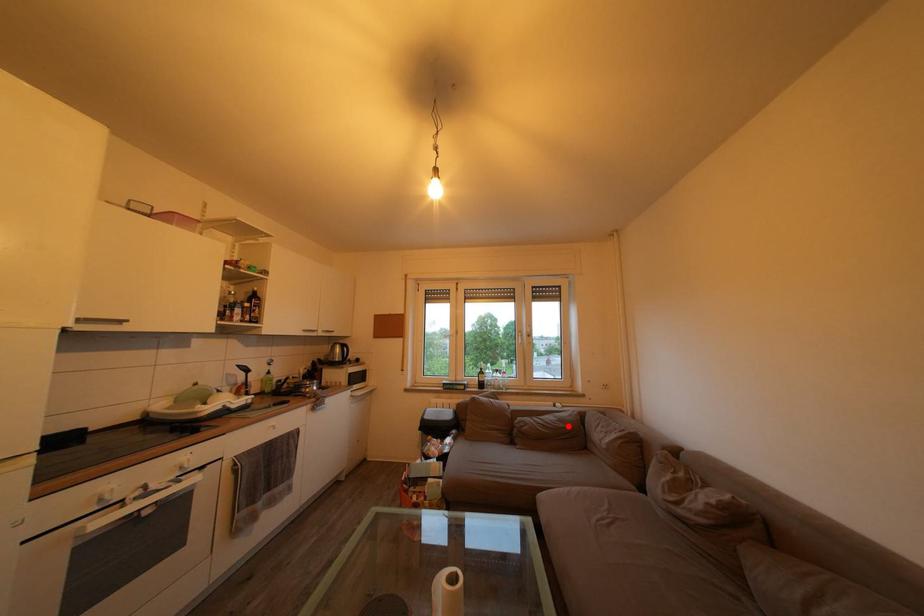
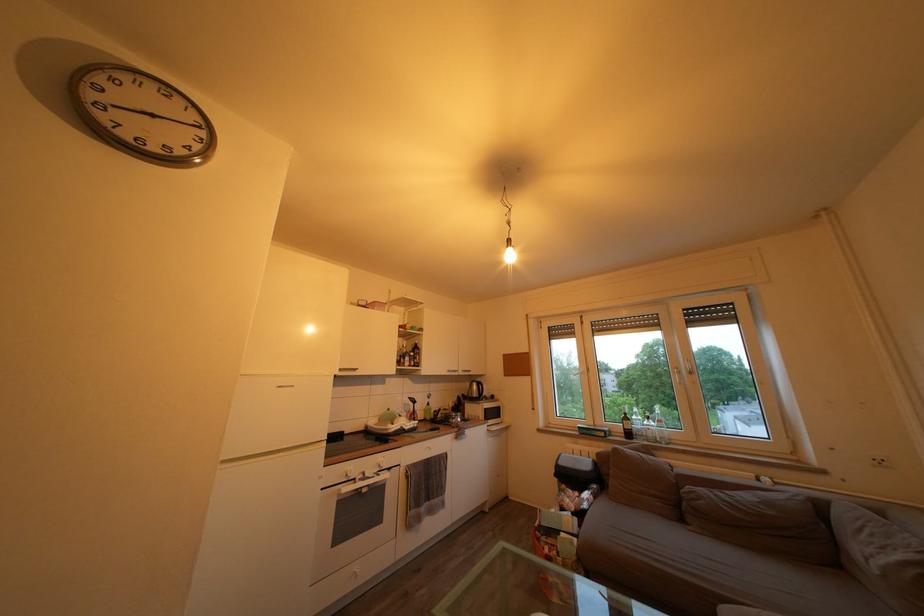
The point at the highlighted location is marked in the first image. Where is the corresponding point in the second image?

(774, 509)